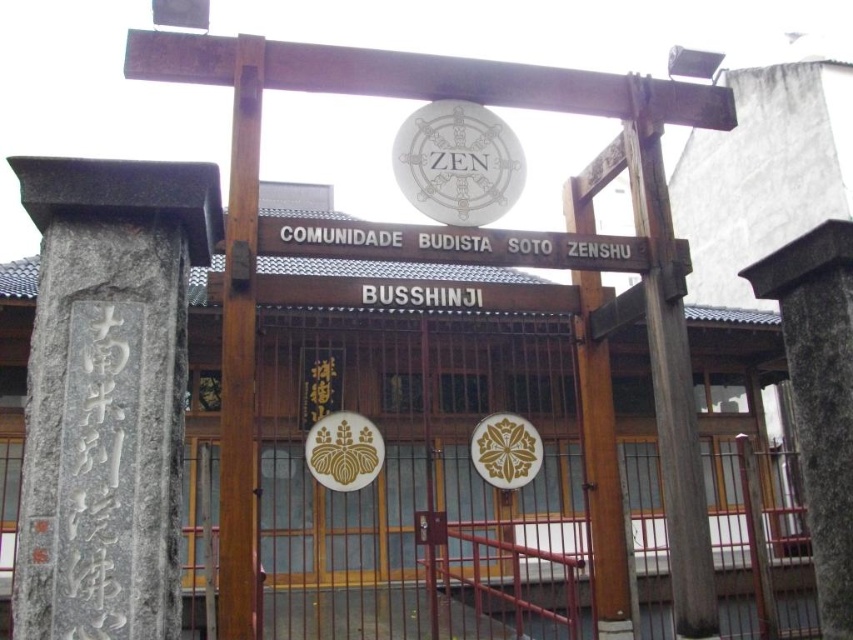
Which is behind, point (247, 637) or point (482, 131)?

The point (482, 131) is behind.

Locate an element on the screen. The width and height of the screenshot is (853, 640). wooden post at center is located at coordinates (239, 352).

Can you confirm if wooden post at center is positioned above white wooden sign at center?

No, wooden post at center is not above white wooden sign at center.

Describe the element at coordinates (239, 352) in the screenshot. I see `wooden post at center` at that location.

Where is `wooden post at center`? Image resolution: width=853 pixels, height=640 pixels. wooden post at center is located at coordinates click(239, 352).

Does gray stone pillar at center have a smaller size compared to white paper sign at center?

No, gray stone pillar at center is not smaller than white paper sign at center.

Does gray stone pillar at center appear on the left side of white paper sign at center?

Incorrect, gray stone pillar at center is not on the left side of white paper sign at center.

You are a GUI agent. You are given a task and a screenshot of the screen. Output one action in this format:
    pyautogui.click(x=<x>, y=<y>)
    Task: Click on the gray stone pillar at center
    Image resolution: width=853 pixels, height=640 pixels.
    Given the screenshot: What is the action you would take?
    coord(819,397)

This screenshot has width=853, height=640. Identify the location of gray stone pillar at center. (819, 397).